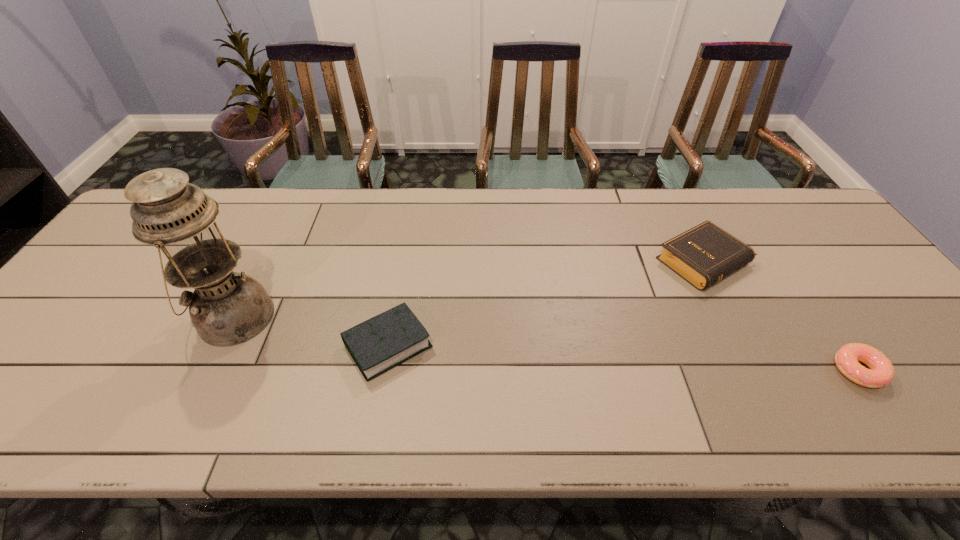
The image size is (960, 540). Identify the location of oil lamp. (227, 308).

Locate an element on the screen. Image resolution: width=960 pixels, height=540 pixels. the tallest object is located at coordinates (227, 308).

This screenshot has height=540, width=960. Identify the location of the right Bible. (705, 254).

Where is `the third object from left to right`? Image resolution: width=960 pixels, height=540 pixels. the third object from left to right is located at coordinates (705, 254).

You are a GUI agent. You are given a task and a screenshot of the screen. Output one action in this format:
    pyautogui.click(x=<x>, y=<y>)
    Task: Click on the third object from right to left
    This screenshot has height=540, width=960.
    Given the screenshot: What is the action you would take?
    pyautogui.click(x=382, y=342)

You are a GUI agent. You are given a task and a screenshot of the screen. Output one action in this format:
    pyautogui.click(x=<x>, y=<y>)
    Task: Click on the nearer Bible
    The image size is (960, 540).
    Given the screenshot: What is the action you would take?
    (382, 342)

You are a GUI agent. You are given a task and a screenshot of the screen. Output one action in this format:
    pyautogui.click(x=<x>, y=<y>)
    Task: Click on the rightmost object
    The width and height of the screenshot is (960, 540).
    Given the screenshot: What is the action you would take?
    pyautogui.click(x=881, y=372)

Identify the location of vacant space located 0.260m on the right of the tallest object. The image size is (960, 540). (379, 318).

Identify the location of free spot located on the back of the farther Bible. (675, 202).

What are the coordinates of `vacant space located 0.310m on the left of the second object from left to right` in the screenshot? It's located at (209, 345).